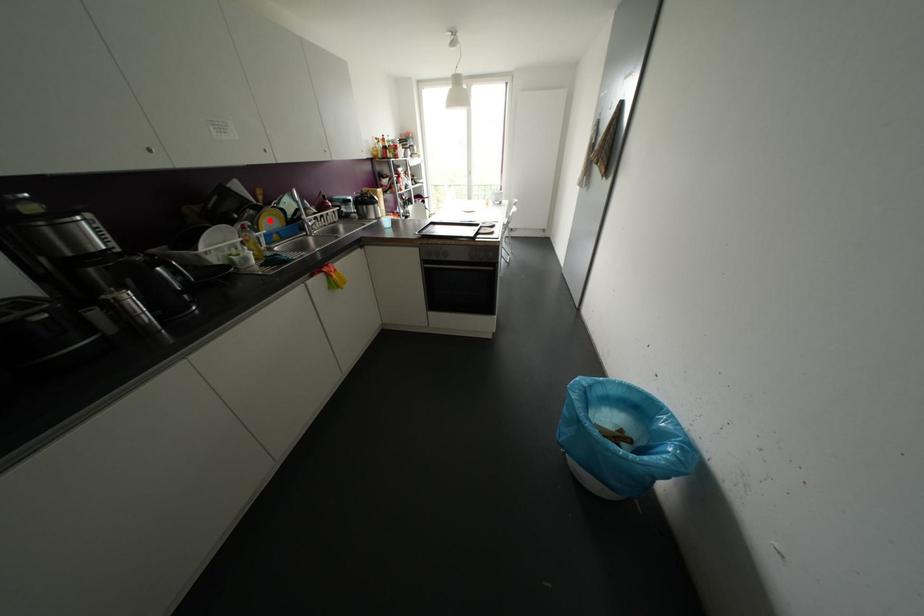
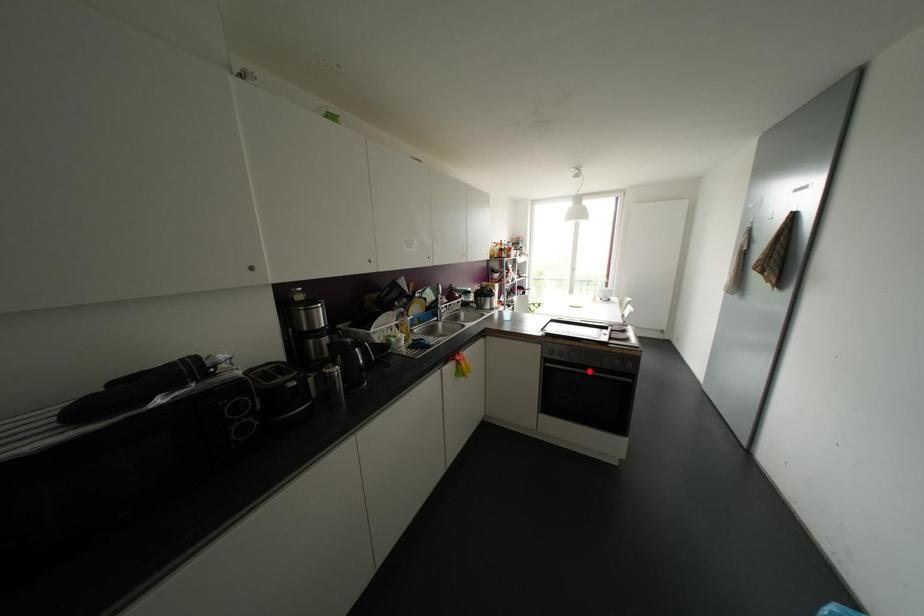
In the scene shown: I am providing you with two images of the same scene from different viewpoints. A red point is marked on the first image and another point is marked on the second image. Is the marked point in image1 the same physical position as the marked point in image2?

No